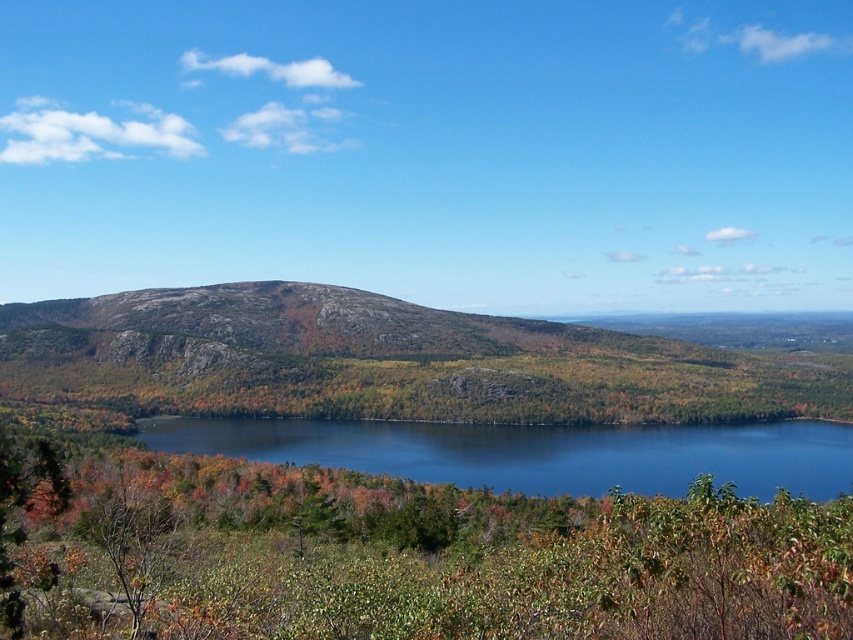
Is point (838, 364) closer to camera compared to point (293, 461)?

No, it is not.

Does rocky terrain at center appear over blue liquid water at center?

Indeed, rocky terrain at center is positioned over blue liquid water at center.

Between point (669, 410) and point (442, 476), which one is positioned in front?

Point (442, 476) is more forward.

Find the location of `rocky terrain at center`. rocky terrain at center is located at coordinates (386, 362).